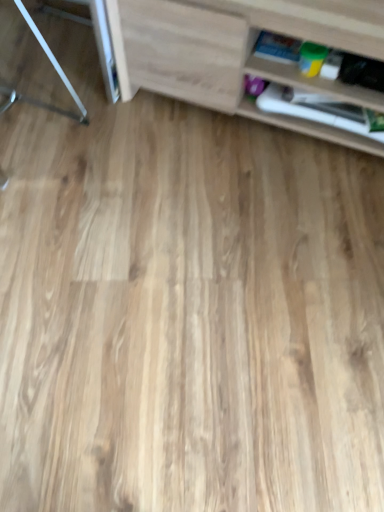
I want to click on vacant space that's between light wood cabinet at upper right, placed as the 1th shelf when sorted from front to back, and metallic silver table at left, so click(181, 126).